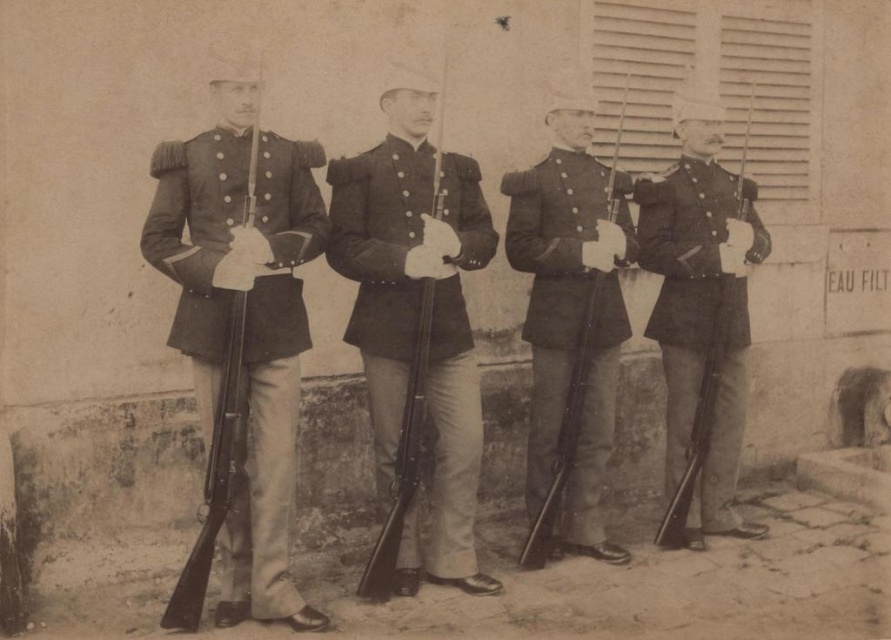
You are a photographer positioned at the camera. You want to take a closeup shot of the dark gray wool uniform at center. Considering your current position, do you need to move closer or farther away to achieve this closeup?

The dark gray wool uniform at center is 18.21 feet away from the camera. To take a closeup shot, you would need to move closer to the subject, reducing the distance between the camera and the dark gray wool uniform at center.